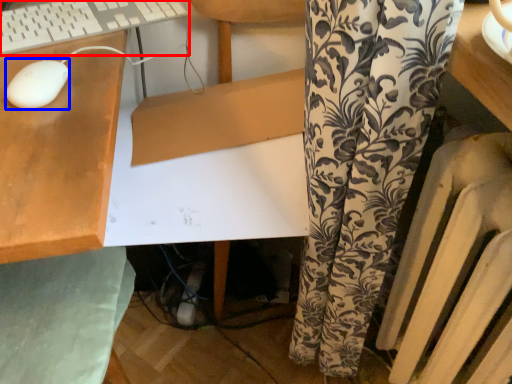
Question: Among these objects, which one is nearest to the camera, computer keyboard (highlighted by a red box) or mouse (highlighted by a blue box)?

Choices:
 (A) computer keyboard
 (B) mouse

Answer: (B)